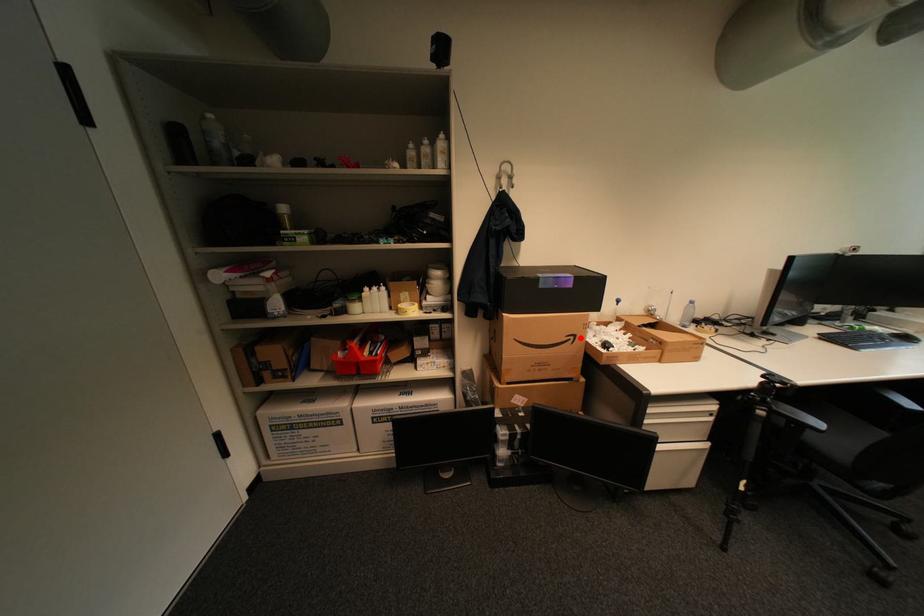
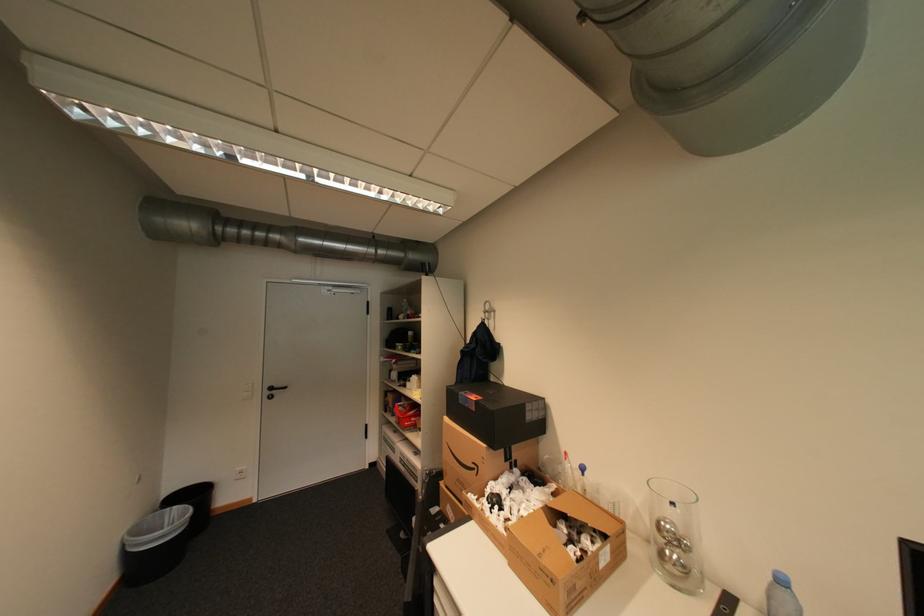
The point at the highlighted location is marked in the first image. Where is the corresponding point in the second image?

(484, 468)